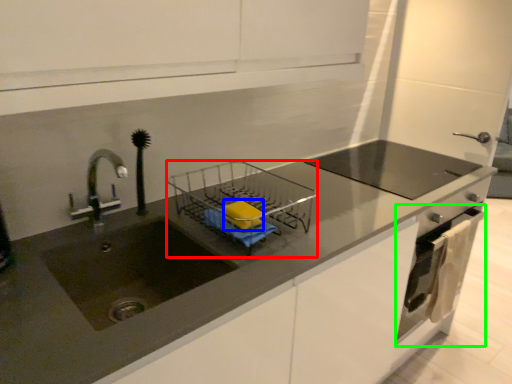
Question: Considering the real-world distances, which object is farthest from appliance (highlighted by a red box)? soap (highlighted by a blue box) or oven (highlighted by a green box)?

Choices:
 (A) soap
 (B) oven

Answer: (B)